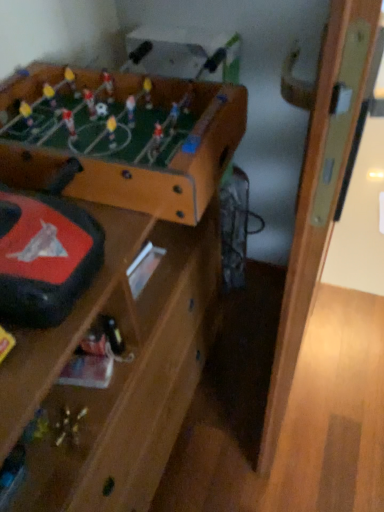
Question: From a real-world perspective, is wooden door at right below wooden foosball table at upper left?

Choices:
 (A) no
 (B) yes

Answer: (B)

Question: Considering the relative sizes of wooden door at right and wooden foosball table at upper left in the image provided, is wooden door at right taller than wooden foosball table at upper left?

Choices:
 (A) yes
 (B) no

Answer: (A)

Question: From the image's perspective, does wooden door at right appear higher than wooden foosball table at upper left?

Choices:
 (A) yes
 (B) no

Answer: (B)

Question: Does wooden door at right have a lesser height compared to wooden foosball table at upper left?

Choices:
 (A) no
 (B) yes

Answer: (A)

Question: Can we say wooden door at right lies outside wooden foosball table at upper left?

Choices:
 (A) no
 (B) yes

Answer: (B)

Question: Looking at the image, does wooden foosball table at upper left seem bigger or smaller compared to wooden door at right?

Choices:
 (A) small
 (B) big

Answer: (A)

Question: From the image's perspective, is wooden foosball table at upper left located above or below wooden door at right?

Choices:
 (A) below
 (B) above

Answer: (B)

Question: In the image, is wooden foosball table at upper left positioned in front of or behind wooden door at right?

Choices:
 (A) behind
 (B) front

Answer: (A)

Question: From a real-world perspective, is wooden foosball table at upper left physically located above or below wooden door at right?

Choices:
 (A) below
 (B) above

Answer: (B)

Question: Is metallic silver toy at center to the left or to the right of wooden foosball table at upper left in the image?

Choices:
 (A) left
 (B) right

Answer: (B)

Question: Is metallic silver toy at center bigger or smaller than wooden foosball table at upper left?

Choices:
 (A) small
 (B) big

Answer: (A)

Question: Is point (97, 352) positioned closer to the camera than point (56, 70)?

Choices:
 (A) closer
 (B) farther

Answer: (A)

Question: Is metallic silver toy at center wider or thinner than wooden foosball table at upper left?

Choices:
 (A) wide
 (B) thin

Answer: (B)

Question: Is point (114, 176) positioned closer to the camera than point (122, 352)?

Choices:
 (A) farther
 (B) closer

Answer: (B)

Question: From their relative heights in the image, would you say wooden foosball table at upper left is taller or shorter than metallic silver toy at center?

Choices:
 (A) tall
 (B) short

Answer: (A)